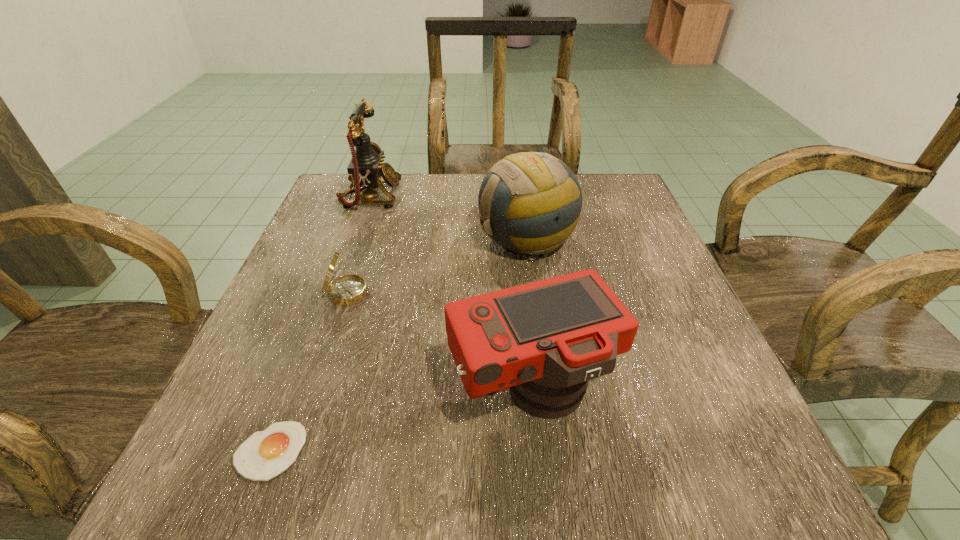
The width and height of the screenshot is (960, 540). I want to click on free location that satisfies the following two spatial constraints: 1. on the back side of the volleyball; 2. on the left side of the shortest object, so click(x=349, y=239).

This screenshot has height=540, width=960. In order to click on free space that satisfies the following two spatial constraints: 1. on the front of the telephone, featuring the rotary dial; 2. on the left side of the volleyball in this screenshot , I will do `click(355, 239)`.

Locate an element on the screen. free spot that satisfies the following two spatial constraints: 1. on the front of the camera, featuring the rotary dial; 2. on the right side of the telephone is located at coordinates (300, 390).

Find the location of a particular element. vacant position in the image that satisfies the following two spatial constraints: 1. on the front of the telephone, featuring the rotary dial; 2. on the right side of the volleyball is located at coordinates (355, 239).

The width and height of the screenshot is (960, 540). I want to click on vacant space that satisfies the following two spatial constraints: 1. on the front of the volleyball, featuring the rotary dial; 2. on the left side of the telephone, so (355, 239).

This screenshot has height=540, width=960. What are the coordinates of `free space that satisfies the following two spatial constraints: 1. on the front side of the volleyball; 2. with the dial facing the second shortest object` in the screenshot? It's located at (534, 293).

Locate an element on the screen. This screenshot has width=960, height=540. free spot that satisfies the following two spatial constraints: 1. with the dial facing the compass; 2. on the right side of the camera is located at coordinates (320, 390).